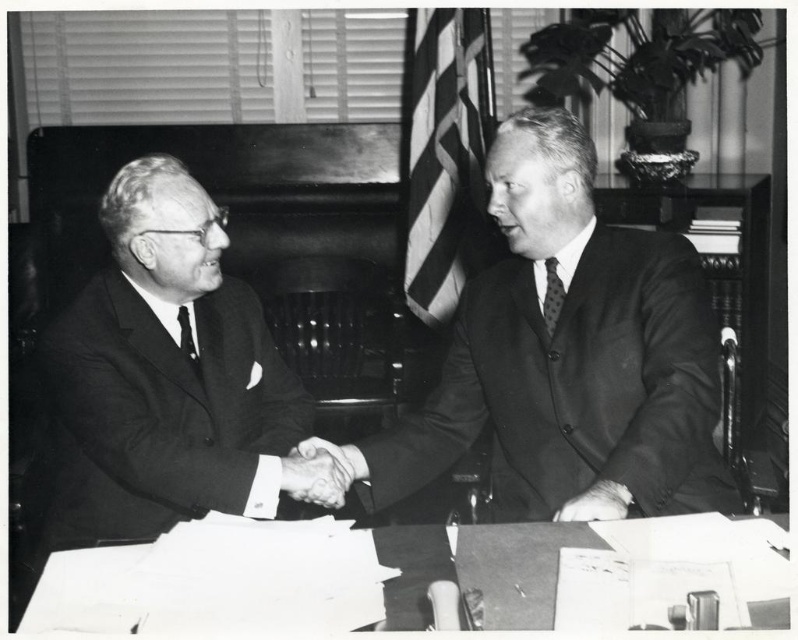
You are a photographer analyzing this black and white photo. You need to determine if the width of the smooth skin handshake at center can fit entirely within the width of the polka dot silk tie at right. Can it?

The smooth skin handshake at center has a greater width than the polka dot silk tie at right, so it cannot fit entirely within the tie.